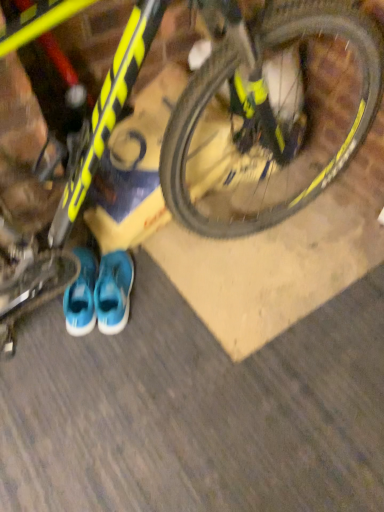
You are a GUI agent. You are given a task and a screenshot of the screen. Output one action in this format:
    pyautogui.click(x=<x>, y=<y>)
    Task: Click on the vacant space in front of blue fabric sneakers at lower center
    
    Given the screenshot: What is the action you would take?
    pyautogui.click(x=71, y=349)